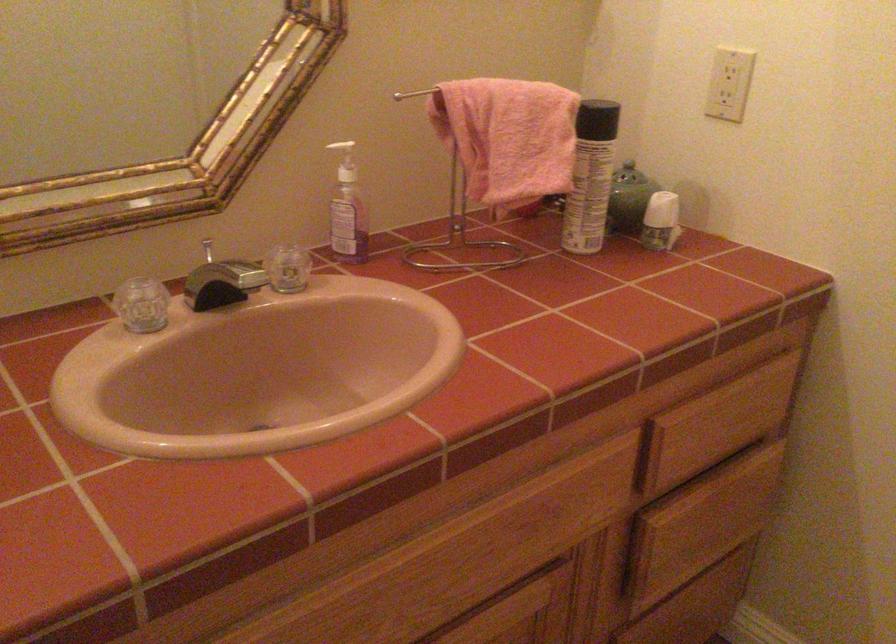
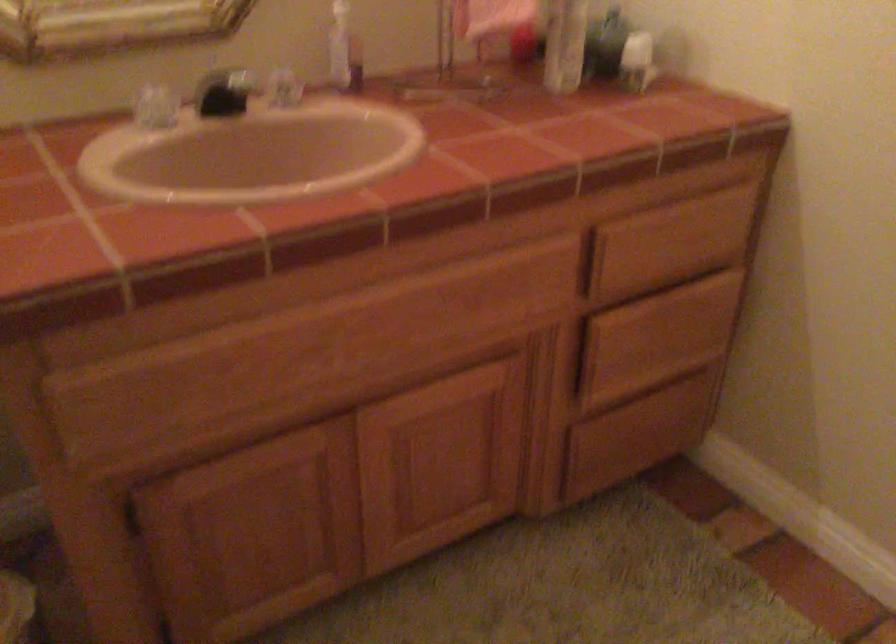
The point at (711,524) is marked in the first image. Where is the corresponding point in the second image?

(657, 337)